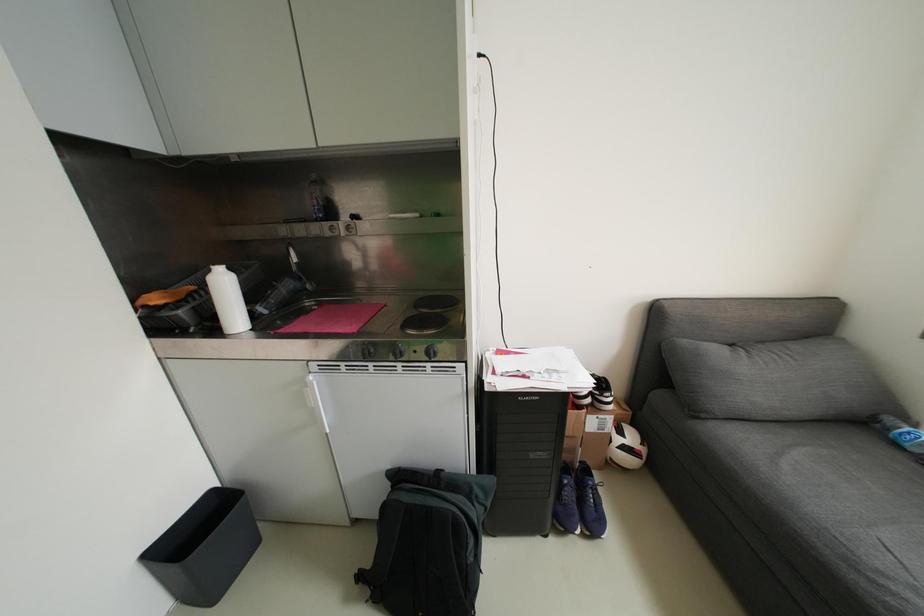
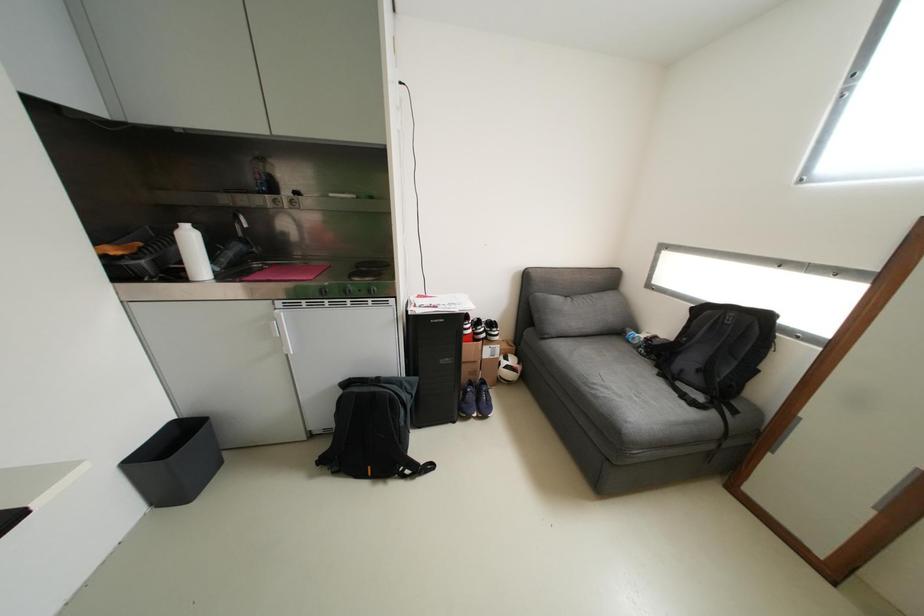
Question: The camera is either moving clockwise (left) or counter-clockwise (right) around the object. The first image is from the beginning of the video and the second image is from the end. Is the camera moving left or right when shooting the video?

Choices:
 (A) Left
 (B) Right

Answer: (A)